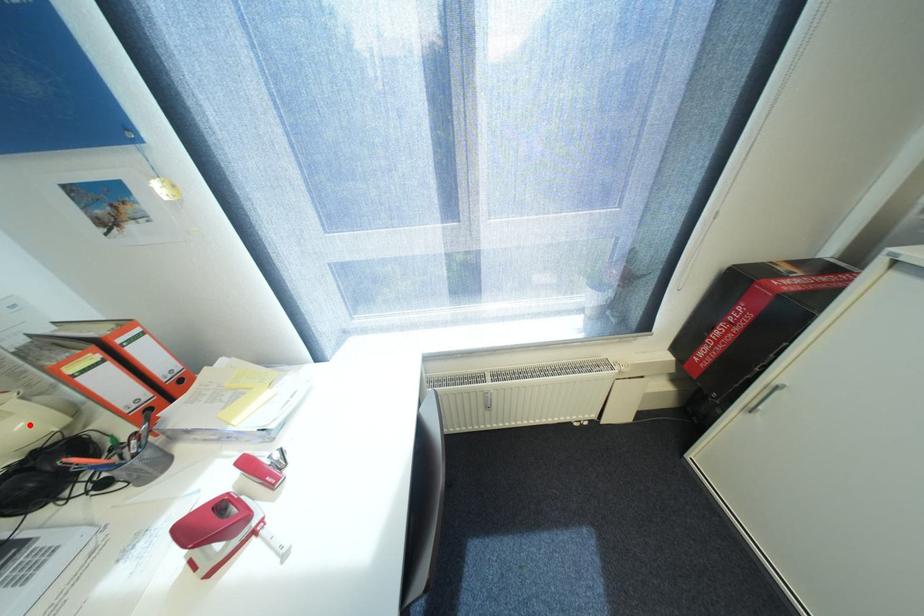
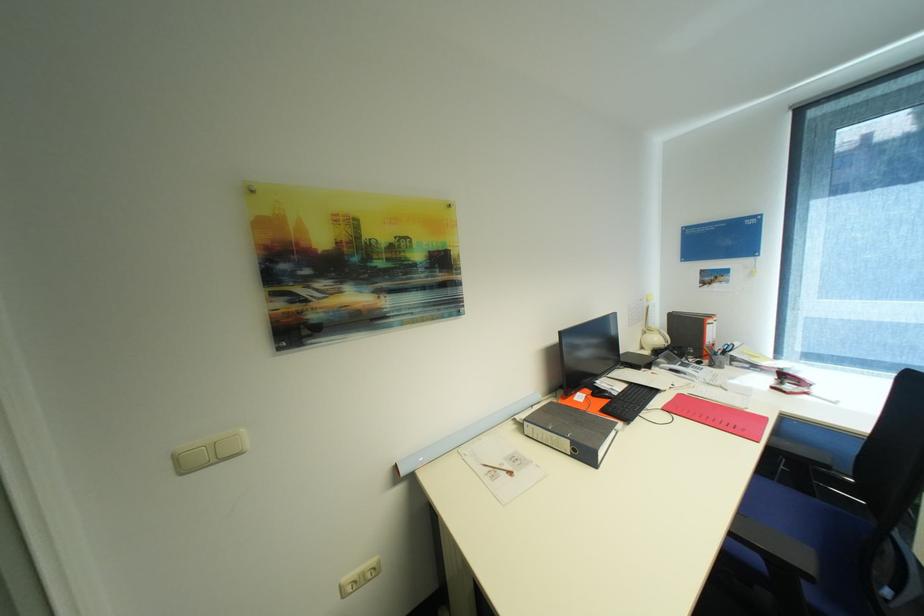
The point at the highlighted location is marked in the first image. Where is the corresponding point in the second image?

(663, 339)